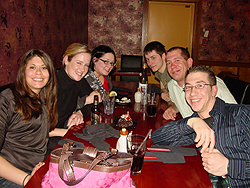
Locate an element on the screen. The image size is (250, 188). wall is located at coordinates (129, 36), (43, 36), (222, 40).